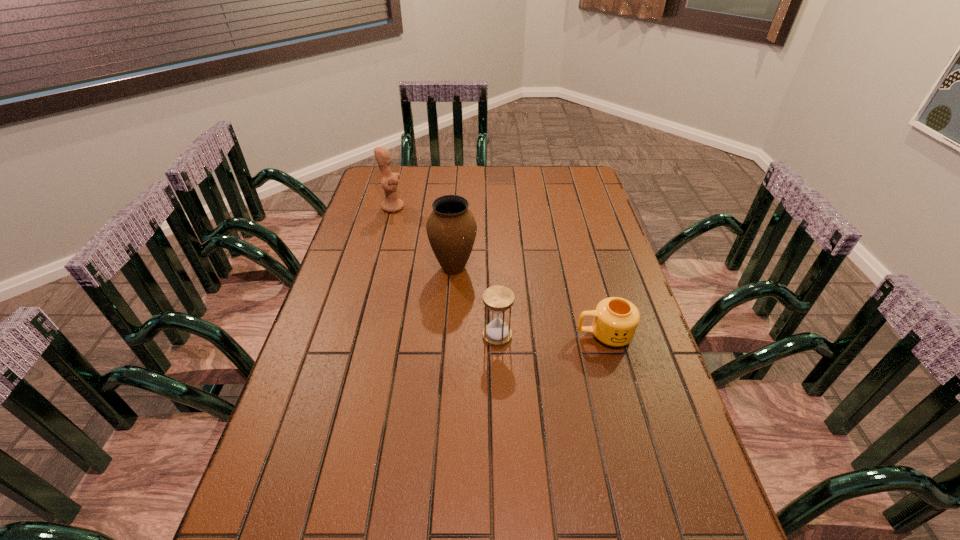
Identify the location of free point between the urn and the rightmost object. (529, 301).

This screenshot has height=540, width=960. I want to click on free space between the rightmost object and the leftmost object, so click(498, 271).

Locate an element on the screen. free area in between the second shortest object and the rightmost object is located at coordinates (551, 335).

Where is `free space between the figurine and the rightmost object`? This screenshot has height=540, width=960. free space between the figurine and the rightmost object is located at coordinates click(498, 271).

Where is `free space between the third nearest object and the figurine`? Image resolution: width=960 pixels, height=540 pixels. free space between the third nearest object and the figurine is located at coordinates 423,238.

Where is `vacant area that lies between the third nearest object and the figurine`? This screenshot has width=960, height=540. vacant area that lies between the third nearest object and the figurine is located at coordinates (423, 238).

The height and width of the screenshot is (540, 960). What are the coordinates of `vacant area that lies between the figurine and the rightmost object` in the screenshot? It's located at (498, 271).

The image size is (960, 540). Find the location of `empty location between the third object from left to right and the shortest object`. empty location between the third object from left to right and the shortest object is located at coordinates pyautogui.click(x=551, y=335).

Locate which object is the third closest to the figurine. Please provide its 2D coordinates. Your answer should be formatted as a tuple, i.e. [(x, y)], where the tuple contains the x and y coordinates of a point satisfying the conditions above.

[(615, 322)]

Image resolution: width=960 pixels, height=540 pixels. I want to click on the third closest object to the figurine, so click(x=615, y=322).